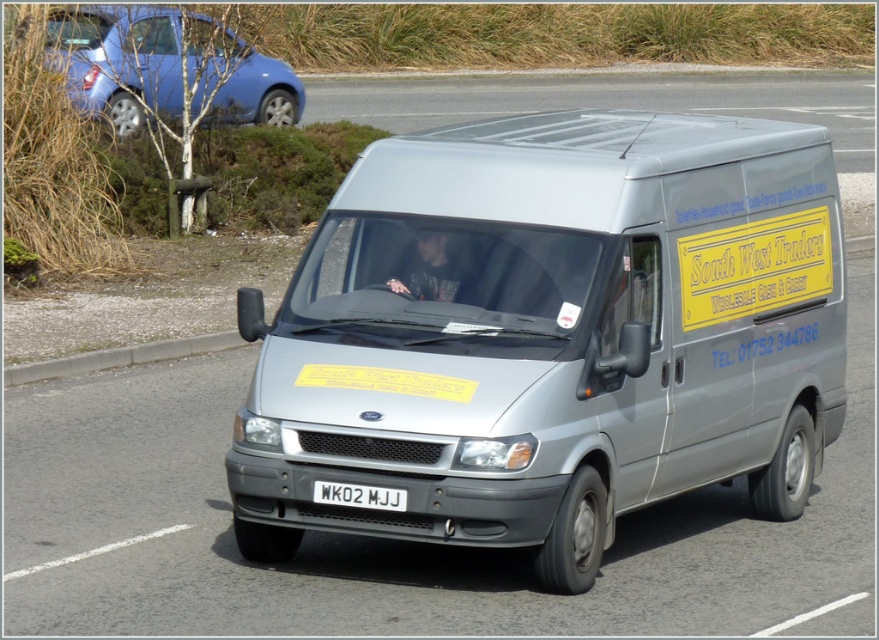
Is silver metallic van at center thinner than metallic blue hatchback at upper left?

Incorrect, silver metallic van at center's width is not less than metallic blue hatchback at upper left's.

Can you confirm if silver metallic van at center is wider than metallic blue hatchback at upper left?

Yes.

Locate an element on the screen. The image size is (879, 640). silver metallic van at center is located at coordinates (547, 333).

Find the location of a particular element. The height and width of the screenshot is (640, 879). silver metallic van at center is located at coordinates (547, 333).

Which is in front, point (619, 458) or point (44, 371)?

Point (619, 458)

You are a GUI agent. You are given a task and a screenshot of the screen. Output one action in this format:
    pyautogui.click(x=<x>, y=<y>)
    Task: Click on the silver metallic van at center
    This screenshot has width=879, height=640.
    Given the screenshot: What is the action you would take?
    pyautogui.click(x=547, y=333)

Does point (666, 380) lie in front of point (322, 488)?

No, it is behind (322, 488).

Does silver metallic van at center have a larger size compared to white plastic license plate at center?

Indeed, silver metallic van at center has a larger size compared to white plastic license plate at center.

Identify the location of silver metallic van at center. (547, 333).